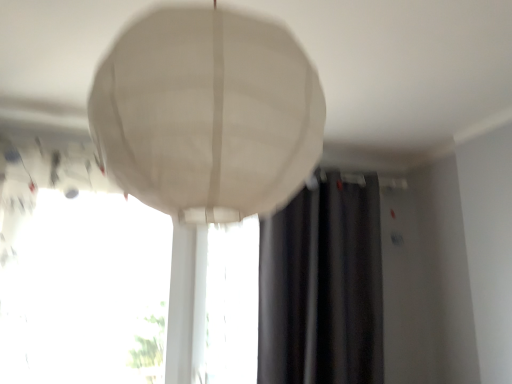
Question: Is point (297, 216) positioned closer to the camera than point (208, 329)?

Choices:
 (A) farther
 (B) closer

Answer: (A)

Question: Is dark gray fabric curtain at center wider or thinner than transparent glass window at center, the second window when ordered from left to right?

Choices:
 (A) thin
 (B) wide

Answer: (B)

Question: Which object is positioned closest to the transparent glass window at center, the first window from the right?

Choices:
 (A) dark gray fabric curtain at center
 (B) white fabric lampshade at center
 (C) transparent glass window at center, which ranks as the second window in right-to-left order

Answer: (A)

Question: Estimate the real-world distances between objects in this image. Which object is closer to the dark gray fabric curtain at center?

Choices:
 (A) white fabric lampshade at center
 (B) transparent glass window at center, which ranks as the second window in right-to-left order
 (C) transparent glass window at center, the first window from the right

Answer: (C)